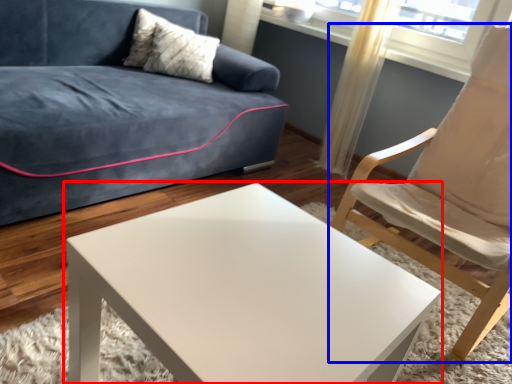
Question: Which object appears farthest to the camera in this image, coffee table (highlighted by a red box) or chair (highlighted by a blue box)?

Choices:
 (A) coffee table
 (B) chair

Answer: (B)